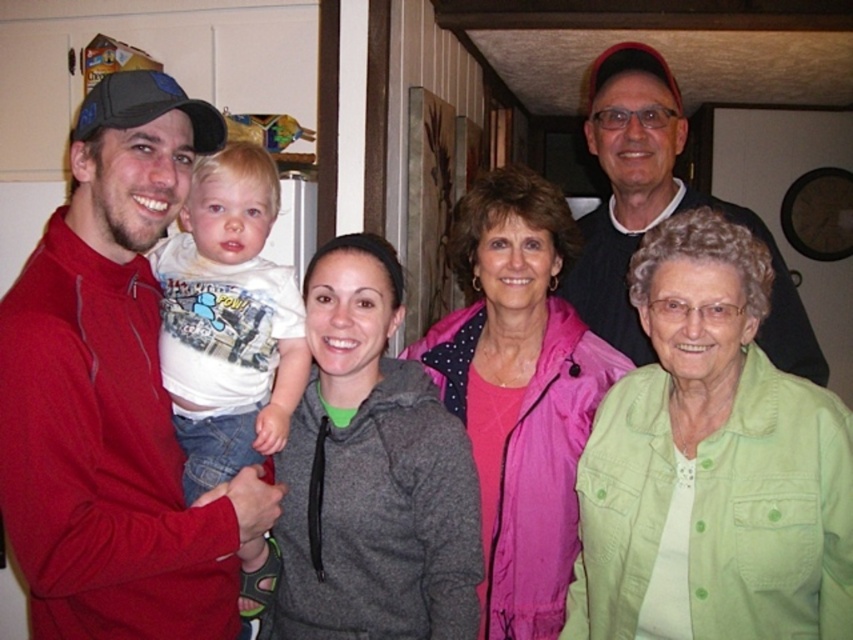
Question: Which point is farther to the camera?

Choices:
 (A) gray fleece jacket at center
 (B) white cotton shirt at center
 (C) pink fabric jacket at center

Answer: (C)

Question: Can you confirm if matte red jacket at left is thinner than gray fleece jacket at center?

Choices:
 (A) yes
 (B) no

Answer: (A)

Question: Which of these objects is positioned closest to the pink fabric jacket at center?

Choices:
 (A) green button-down shirt at lower right
 (B) matte red jacket at left
 (C) gray fleece jacket at center
 (D) white cotton shirt at center

Answer: (C)

Question: Does pink fabric jacket at center come behind white cotton shirt at center?

Choices:
 (A) no
 (B) yes

Answer: (B)

Question: Which object is farther from the camera taking this photo?

Choices:
 (A) matte red jacket at left
 (B) gray fleece jacket at center
 (C) green button-down shirt at lower right

Answer: (B)

Question: Does white cotton shirt at center have a greater width compared to matte black shirt at upper right?

Choices:
 (A) yes
 (B) no

Answer: (B)